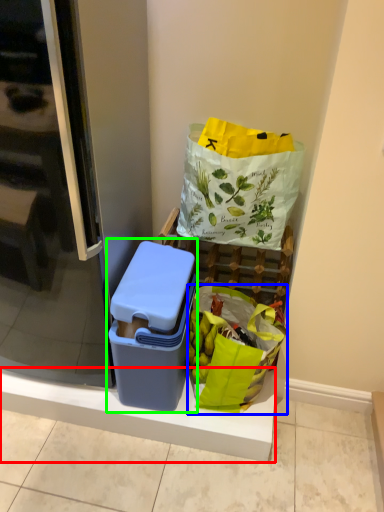
Question: Based on their relative distances, which object is nearer to balustrade (highlighted by a red box)? Choose from grocery bag (highlighted by a blue box) and lunch box (highlighted by a green box).

Choices:
 (A) grocery bag
 (B) lunch box

Answer: (A)